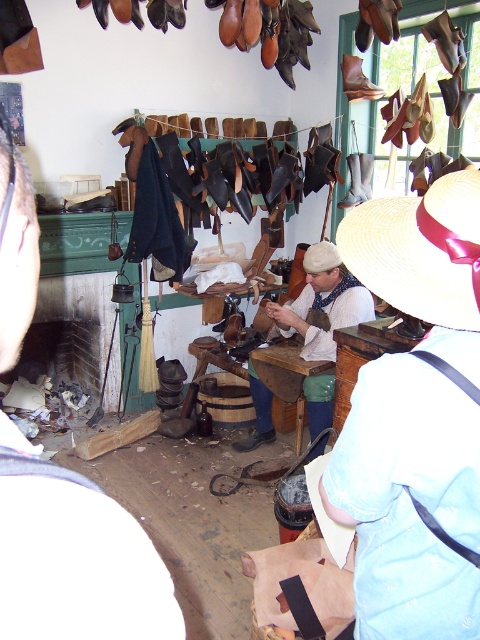
You are a customer in the shoemaker shop and want to know which item is placed above the other between the white straw hat at upper center and the white cotton shirt at center. Can you tell me?

The white straw hat at upper center is positioned over the white cotton shirt at center.

You are a customer in the shoemaker shop and want to see both the white straw hat at upper center and the white cotton shirt at center. Which object is nearer to you?

The white straw hat at upper center is closer to the viewer than the white cotton shirt at center.